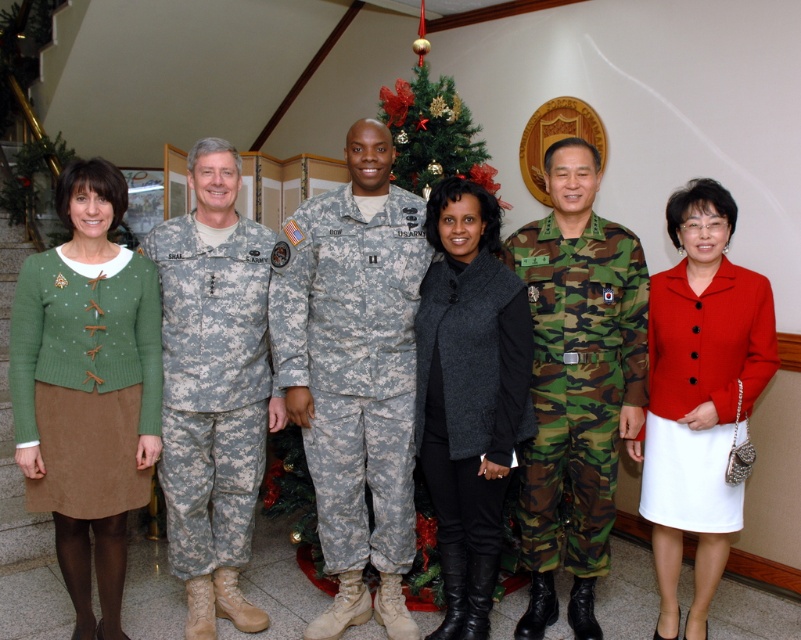
You are a photographer adjusting the camera settings to ensure all subjects are in focus. The two camouflage uniforms at center are close to each other. How far apart are the camouflage uniform at center and the camouflage fabric uniform at center?

The camouflage uniform at center is 11.88 inches from the camouflage fabric uniform at center.

You are a photographer trying to adjust the lighting for a group photo. You notice the green corduroy skirt at center and the camouflage fabric uniform at center. Which of these two items has a narrower silhouette?

The green corduroy skirt at center is thinner than the camouflage fabric uniform at center, so the green corduroy skirt at center has a narrower silhouette.